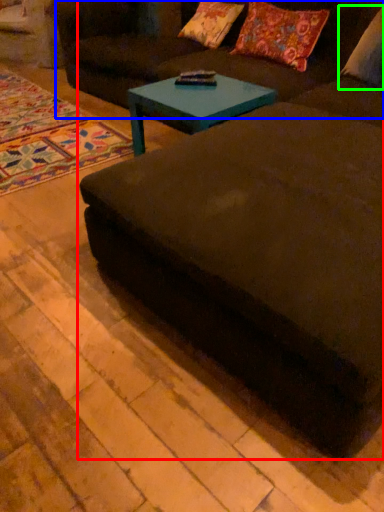
Question: Which object is positioned closest to studio couch (highlighted by a red box)? Select from couch (highlighted by a blue box) and pillow (highlighted by a green box).

Choices:
 (A) couch
 (B) pillow

Answer: (B)